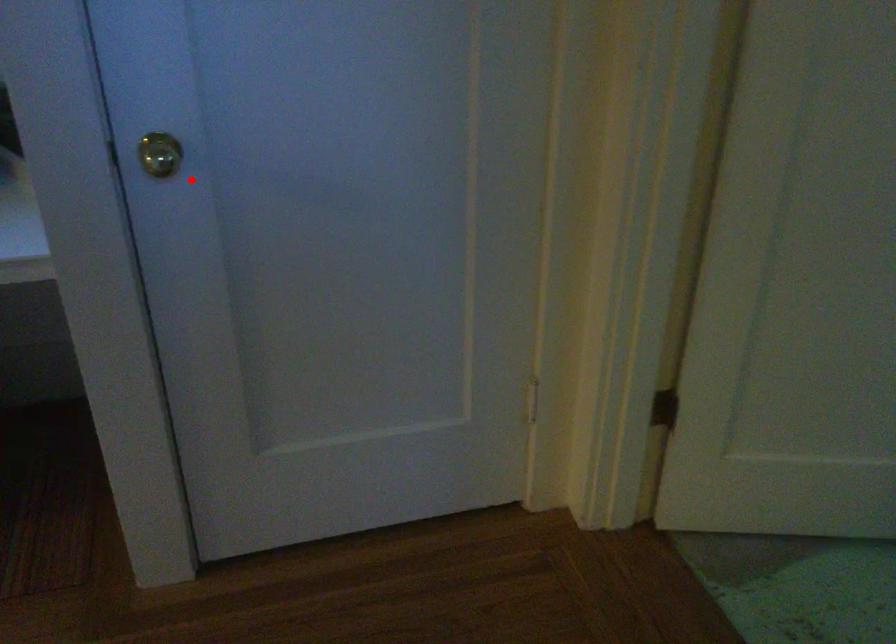
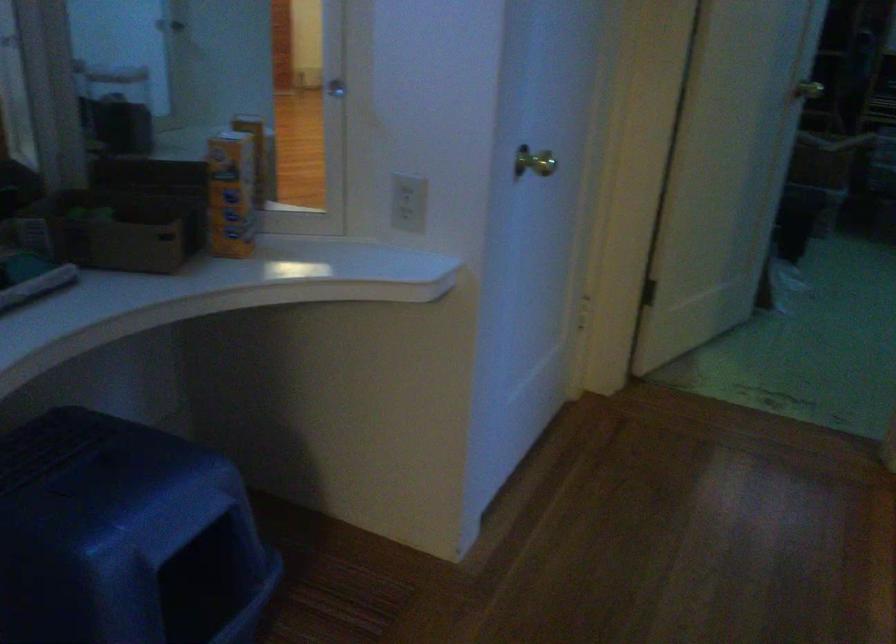
Question: A red point is marked in image1. In image2, is the corresponding 3D point closer to the camera or farther? Reply with the corresponding letter.

Choices:
 (A) The corresponding 3D point is closer.
 (B) The corresponding 3D point is farther.

Answer: (B)